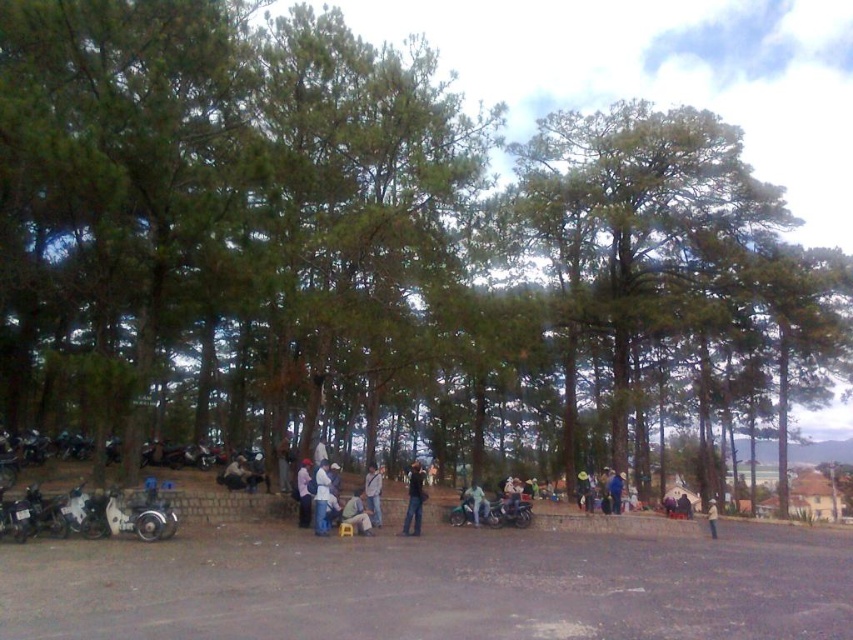
Question: Can you confirm if white matte motorcycle at lower left is smaller than blue fabric jacket at center?

Choices:
 (A) yes
 (B) no

Answer: (A)

Question: Which object appears farthest from the camera in this image?

Choices:
 (A) white cotton shirt at center
 (B) blue fabric jacket at center
 (C) brown fabric hat at center
 (D) white fabric jacket at center

Answer: (B)

Question: Observing the image, what is the correct spatial positioning of white matte motorcycle at lower left in reference to blue fabric jacket at center?

Choices:
 (A) above
 (B) below

Answer: (A)

Question: Which point is farther to the camera?

Choices:
 (A) light brown fabric bag at center
 (B) black leather jacket at center
 (C) brown fabric hat at center
 (D) white matte motorcycle at lower left

Answer: (C)

Question: Can you confirm if light brown fabric bag at center is wider than light brown leather jacket at center?

Choices:
 (A) no
 (B) yes

Answer: (A)

Question: Estimate the real-world distances between objects in this image. Which object is closer to the brown fabric hat at center?

Choices:
 (A) blue fabric jacket at center
 (B) white matte motorcycle at lower left

Answer: (A)